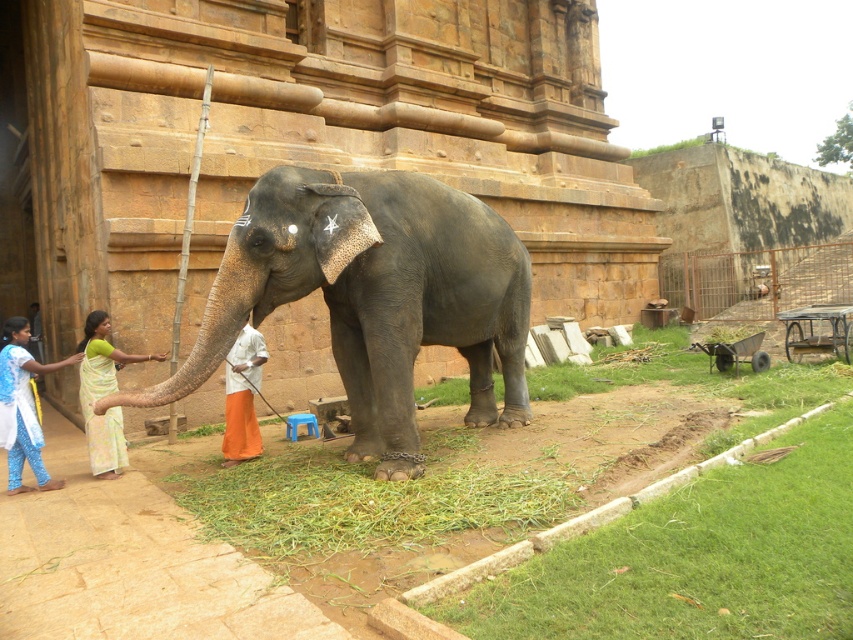
Question: Can you confirm if green grass at lower center is positioned above blue cotton dress at lower left?

Choices:
 (A) no
 (B) yes

Answer: (A)

Question: Does gray textured elephant at center have a greater width compared to light yellow floral saree at center?

Choices:
 (A) no
 (B) yes

Answer: (B)

Question: Which point is closer to the camera taking this photo?

Choices:
 (A) (340, 173)
 (B) (21, 358)
 (C) (94, 436)
 (D) (234, 401)

Answer: (B)

Question: Can you confirm if green grass at lower center is wider than orange cloth at center?

Choices:
 (A) no
 (B) yes

Answer: (B)

Question: Which point is farther from the camera taking this photo?

Choices:
 (A) (480, 484)
 (B) (97, 426)
 (C) (349, 221)
 (D) (32, 372)

Answer: (B)

Question: Which point is farther from the camera taking this photo?

Choices:
 (A) (28, 460)
 (B) (416, 467)
 (C) (108, 390)
 (D) (431, 528)

Answer: (C)